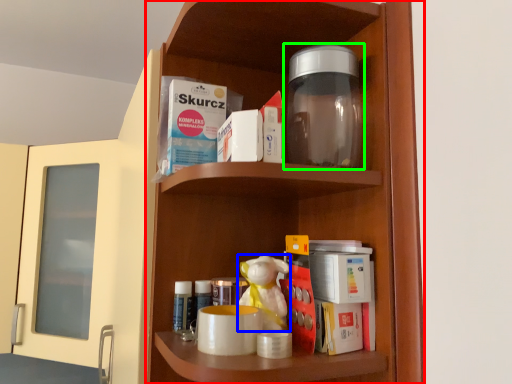
Question: Which object is the closest to the shelf (highlighted by a red box)? Choose among these: toy (highlighted by a blue box) or bottle (highlighted by a green box).

Choices:
 (A) toy
 (B) bottle

Answer: (B)